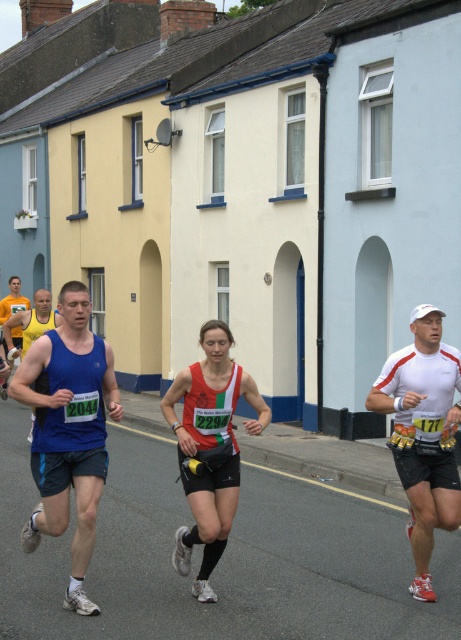
Question: Which object is closer to the camera taking this photo?

Choices:
 (A) blue fabric tank top at center
 (B) blue fabric tank top at left
 (C) white matte running shirt at center
 (D) red and white running outfit at center

Answer: (A)

Question: Considering the real-world distances, which object is closest to the red and white running outfit at center?

Choices:
 (A) blue fabric tank top at center
 (B) white matte running shirt at center
 (C) blue fabric tank top at left

Answer: (A)

Question: Does blue fabric tank top at center appear over blue fabric tank top at left?

Choices:
 (A) no
 (B) yes

Answer: (A)

Question: Is the position of red and white running outfit at center less distant than that of blue fabric tank top at left?

Choices:
 (A) yes
 (B) no

Answer: (A)

Question: Which point is closer to the camera?

Choices:
 (A) click(213, 449)
 (B) click(34, 316)
 (C) click(94, 406)

Answer: (C)

Question: Is the position of white matte running shirt at center less distant than that of blue fabric tank top at left?

Choices:
 (A) yes
 (B) no

Answer: (A)